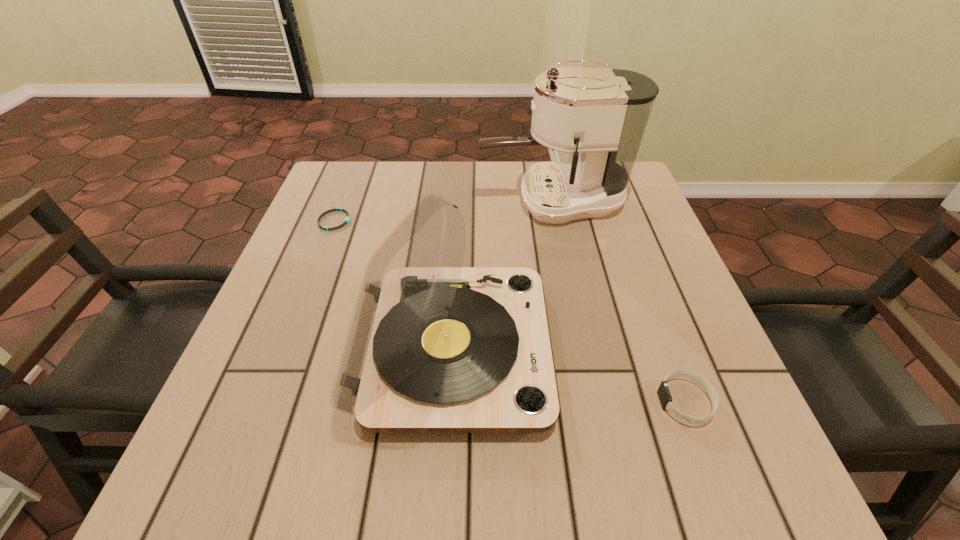
Where is `vacant area that lies between the right wristband and the coffee maker`? The height and width of the screenshot is (540, 960). vacant area that lies between the right wristband and the coffee maker is located at coordinates (619, 301).

You are a GUI agent. You are given a task and a screenshot of the screen. Output one action in this format:
    pyautogui.click(x=<x>, y=<y>)
    Task: Click on the object that stands as the closest to the tallest object
    This screenshot has height=540, width=960.
    Given the screenshot: What is the action you would take?
    pyautogui.click(x=433, y=347)

Select which object appears as the third closest to the record player. Please provide its 2D coordinates. Your answer should be formatted as a tuple, i.e. [(x, y)], where the tuple contains the x and y coordinates of a point satisfying the conditions above.

[(347, 219)]